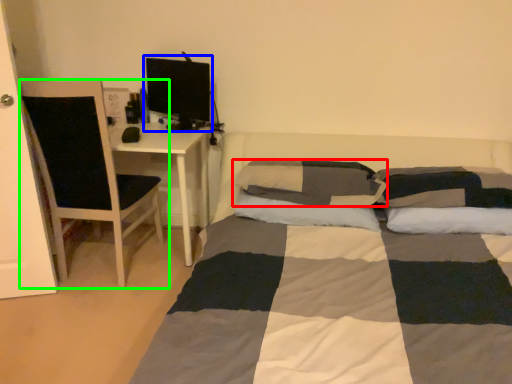
Question: Which is farther away from pillow (highlighted by a red box)? computer monitor (highlighted by a blue box) or chair (highlighted by a green box)?

Choices:
 (A) computer monitor
 (B) chair

Answer: (B)